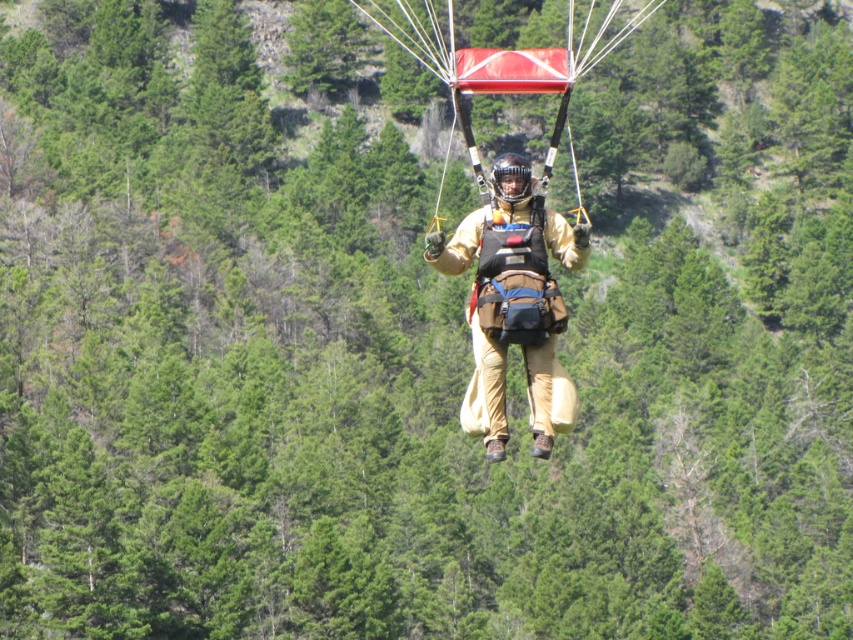
You are a pilot preparing to land your paraglider. You notice two parachutes in the sky, the tan fabric parachute at center and the red fabric parachute at center. Which one is closer to the ground?

The tan fabric parachute at center is closer to the ground because it is not as tall as the red fabric parachute at center.

You are a safety inspector reviewing a paragliding setup. The tan fabric parachute at center must be within 15 meters of the person for safe operation. Is the current distance compliant with safety standards?

The tan fabric parachute at center is 17.75 meters away from the person, exceeding the 15 meters safety limit. This setup does not comply with safety standards.